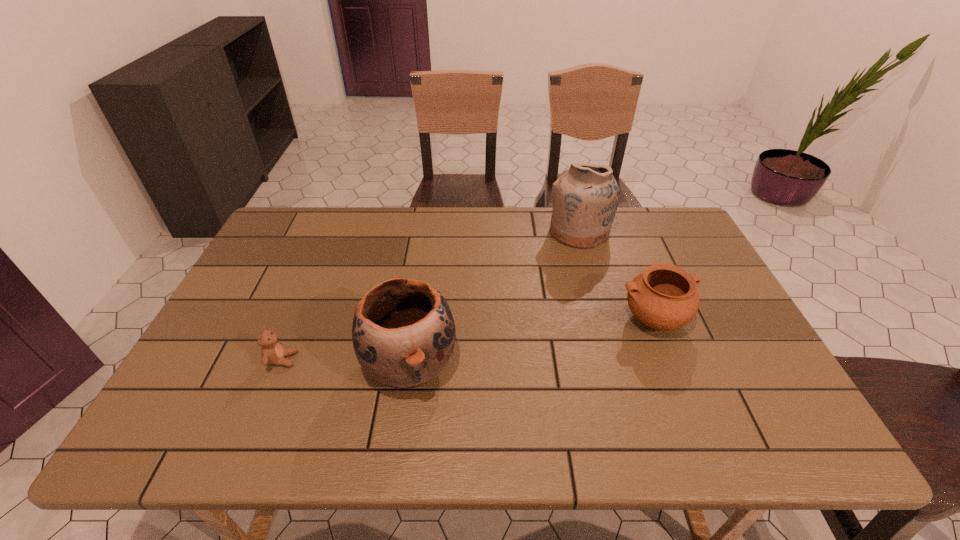
You are a GUI agent. You are given a task and a screenshot of the screen. Output one action in this format:
    pyautogui.click(x=<x>, y=<y>)
    Task: Click on the farthest pottery
    This screenshot has width=960, height=540.
    Given the screenshot: What is the action you would take?
    pyautogui.click(x=585, y=197)

Identify the location of the farthest object. (585, 197).

Where is `the leftmost pottery`? The width and height of the screenshot is (960, 540). the leftmost pottery is located at coordinates (403, 333).

Locate an element on the screen. Image resolution: width=960 pixels, height=540 pixels. the second tallest pottery is located at coordinates (403, 333).

The height and width of the screenshot is (540, 960). Find the location of `the second shortest object`. the second shortest object is located at coordinates (664, 297).

I want to click on the leftmost object, so click(x=272, y=352).

The image size is (960, 540). Find the location of `teddy bear`. teddy bear is located at coordinates (272, 352).

Locate an element on the screen. vacant region located on the front of the farthest object is located at coordinates (590, 271).

At what (x,y) coordinates should I click in order to perform the action: click on free space located on the right of the second shortest pottery. Please return your answer as a coordinate pair (x, y). This screenshot has height=540, width=960. Looking at the image, I should click on (590, 363).

The image size is (960, 540). Find the location of `free location located on the back of the third tallest object`. free location located on the back of the third tallest object is located at coordinates (621, 237).